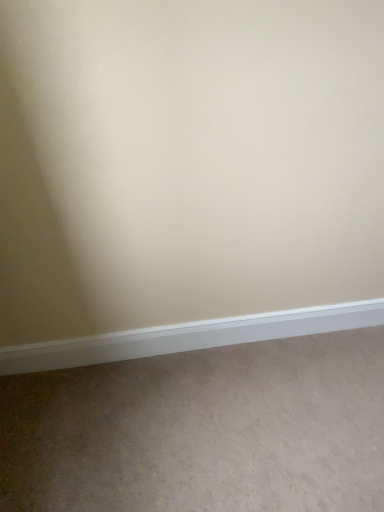
The image size is (384, 512). Identify the location of empty space that is ontop of beige carpet at lower center (from a real-world perspective). (220, 424).